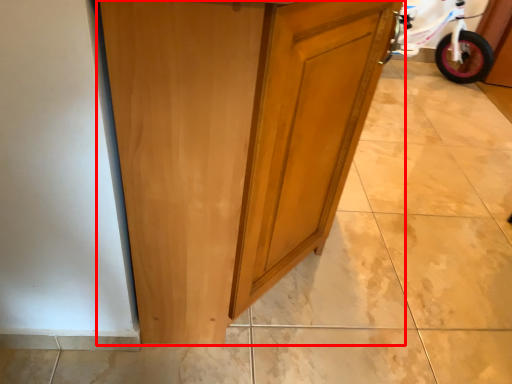
Question: Where is cupboard (annotated by the red box) located in relation to bicycle in the image?

Choices:
 (A) right
 (B) left

Answer: (B)